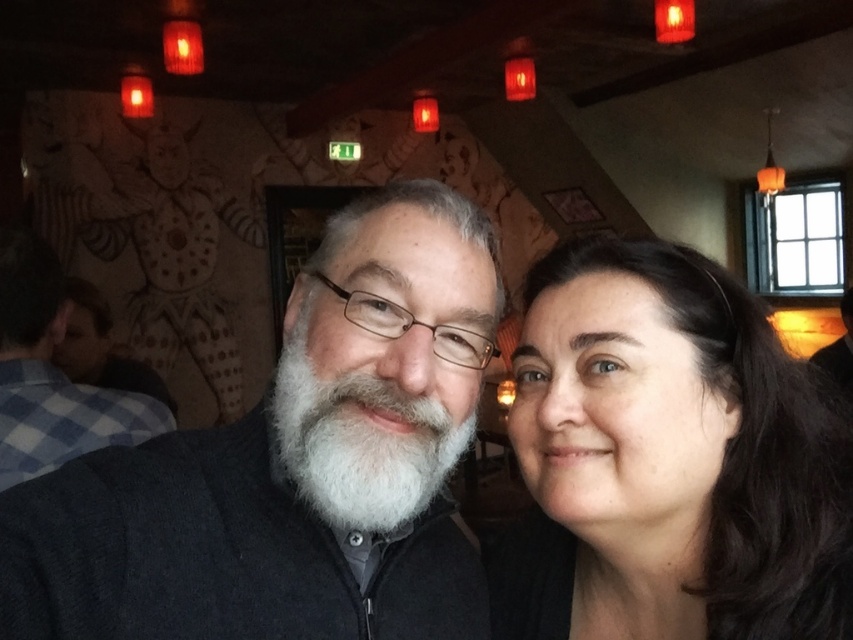
Is point (437, 419) farther from viewer compared to point (28, 256)?

That is False.

From the picture: Who is more distant from viewer, (416,413) or (73,451)?

The point (73,451) is behind.

You are a GUI agent. You are given a task and a screenshot of the screen. Output one action in this format:
    pyautogui.click(x=<x>, y=<y>)
    Task: Click on the white matte beard at center
    
    Given the screenshot: What is the action you would take?
    pyautogui.click(x=358, y=440)

Can you confirm if smooth dark hair at right is smaller than white beard at center?

Yes.

Does smooth dark hair at right appear on the right side of white beard at center?

Correct, you'll find smooth dark hair at right to the right of white beard at center.

What do you see at coordinates (666, 460) in the screenshot?
I see `smooth dark hair at right` at bounding box center [666, 460].

Locate an element on the screen. smooth dark hair at right is located at coordinates (666, 460).

From the picture: Which of these two, dark gray sweater at center or white matte beard at center, stands shorter?

white matte beard at center

Does dark gray sweater at center appear under white matte beard at center?

Indeed, dark gray sweater at center is positioned under white matte beard at center.

Does point (78, 515) lie behind point (341, 388)?

No, it is not.

This screenshot has height=640, width=853. In order to click on dark gray sweater at center in this screenshot , I will do `click(292, 465)`.